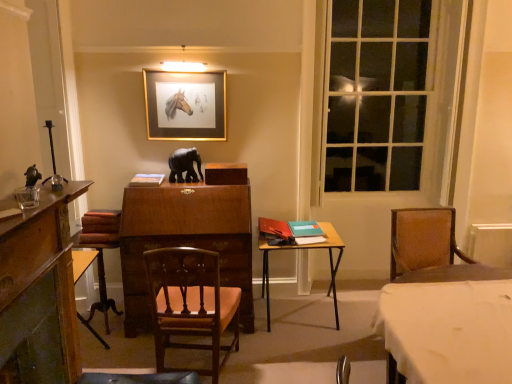
What do you see at coordinates (448, 325) in the screenshot? This screenshot has width=512, height=384. I see `white cloth-covered table at lower right, which is counted as the second table, starting from the back` at bounding box center [448, 325].

This screenshot has height=384, width=512. What do you see at coordinates (301, 250) in the screenshot?
I see `wooden table at center, the second table when ordered from right to left` at bounding box center [301, 250].

What is the approximate width of wooden table at center, which appears as the first table when viewed from the back?

The width of wooden table at center, which appears as the first table when viewed from the back, is 24.28 inches.

Describe the element at coordinates (385, 95) in the screenshot. The height and width of the screenshot is (384, 512). I see `clear glass window at right` at that location.

The image size is (512, 384). Identify the location of clear glass window at right. (385, 95).

In order to face gold-framed picture at upper center, should I rotate leftwards or rightwards?

A 9.398 degree turn to the left will do.

Identify the location of wooden chair at center. The height and width of the screenshot is (384, 512). (190, 303).

Is wooden table at center, which is counted as the second table, starting from the front, bigger or smaller than white cloth-covered table at lower right, arranged as the 1th table when viewed from the right?

In the image, wooden table at center, which is counted as the second table, starting from the front, appears to be smaller than white cloth-covered table at lower right, arranged as the 1th table when viewed from the right.

Is wooden table at center, the first table positioned from the left, spatially inside white cloth-covered table at lower right, arranged as the 1th table when viewed from the right, or outside of it?

wooden table at center, the first table positioned from the left, is outside white cloth-covered table at lower right, arranged as the 1th table when viewed from the right.

From the image's perspective, is wooden table at center, which appears as the first table when viewed from the back, under white cloth-covered table at lower right, which is counted as the second table, starting from the back?

No.

From the picture: In terms of height, does white cloth-covered table at lower right, the 2th table viewed from the left, look taller or shorter compared to matte black elephant at center?

Clearly, white cloth-covered table at lower right, the 2th table viewed from the left, is taller compared to matte black elephant at center.

Does white cloth-covered table at lower right, arranged as the 1th table when viewed from the right, have a larger size compared to matte black elephant at center?

Yes, white cloth-covered table at lower right, arranged as the 1th table when viewed from the right, is bigger than matte black elephant at center.

Would you consider white cloth-covered table at lower right, the first table from the front, to be distant from matte black elephant at center?

white cloth-covered table at lower right, the first table from the front, is positioned a significant distance from matte black elephant at center.

Which is correct: white cloth-covered table at lower right, the 2th table viewed from the left, is inside matte black elephant at center, or outside of it?

white cloth-covered table at lower right, the 2th table viewed from the left, is outside matte black elephant at center.

From the image's perspective, between clear glass window at right and wooden table at center, which appears as the first table when viewed from the back, which one is located above?

From the image's view, clear glass window at right is above.

Can you confirm if clear glass window at right is positioned to the right of wooden table at center, the first table positioned from the left?

Yes.

Can you confirm if clear glass window at right is bigger than wooden table at center, which is counted as the second table, starting from the front?

Actually, clear glass window at right might be smaller than wooden table at center, which is counted as the second table, starting from the front.

How different are the orientations of clear glass window at right and wooden table at center, which appears as the first table when viewed from the back, in degrees?

The angle between the facing direction of clear glass window at right and the facing direction of wooden table at center, which appears as the first table when viewed from the back, is 0.992 degrees.

The image size is (512, 384). I want to click on elephant in front of the gold-framed picture at upper center, so click(184, 165).

Is point (145, 105) farther from viewer compared to point (176, 172)?

Yes, it is.

Considering the positions of objects gold-framed picture at upper center and matte black elephant at center in the image provided, who is behind, gold-framed picture at upper center or matte black elephant at center?

gold-framed picture at upper center is further away from the camera.

Considering the positions of objects gold-framed picture at upper center and matte black elephant at center in the image provided, who is more to the left, gold-framed picture at upper center or matte black elephant at center?

matte black elephant at center is more to the left.

Looking at this image, from a real-world perspective, is white cloth-covered table at lower right, the first table from the front, positioned over clear glass window at right based on gravity?

No, from a real-world perspective, white cloth-covered table at lower right, the first table from the front, is not over clear glass window at right

From the image's perspective, is white cloth-covered table at lower right, arranged as the 1th table when viewed from the right, above clear glass window at right?

No, from the image's perspective, white cloth-covered table at lower right, arranged as the 1th table when viewed from the right, is not over clear glass window at right.

Is white cloth-covered table at lower right, the 2th table viewed from the left, with clear glass window at right?

No, white cloth-covered table at lower right, the 2th table viewed from the left, is not next to clear glass window at right.

Does point (438, 270) come farther from viewer compared to point (423, 36)?

No, (438, 270) is closer to viewer.

In terms of height, does gold-framed picture at upper center look taller or shorter compared to clear glass window at right?

Clearly, gold-framed picture at upper center is shorter compared to clear glass window at right.

Is gold-framed picture at upper center looking in the opposite direction of clear glass window at right?

No, clear glass window at right is not at the back of gold-framed picture at upper center.

Considering the sizes of objects gold-framed picture at upper center and clear glass window at right in the image provided, who is wider, gold-framed picture at upper center or clear glass window at right?

gold-framed picture at upper center.

Which is in front, gold-framed picture at upper center or clear glass window at right?

Positioned in front is clear glass window at right.

How many degrees apart are the facing directions of matte black elephant at center and wooden chair at center?

The angular difference between matte black elephant at center and wooden chair at center is 171 degrees.

From the image's perspective, is matte black elephant at center beneath wooden chair at center?

Incorrect, from the image's perspective, matte black elephant at center is higher than wooden chair at center.

Considering the sizes of objects matte black elephant at center and wooden chair at center in the image provided, who is wider, matte black elephant at center or wooden chair at center?

With larger width is wooden chair at center.

Considering the sizes of objects matte black elephant at center and wooden chair at center in the image provided, who is shorter, matte black elephant at center or wooden chair at center?

With less height is matte black elephant at center.

Where is `table to the right of wooden table at center, the first table positioned from the left`? table to the right of wooden table at center, the first table positioned from the left is located at coordinates (448, 325).

Locate an element on the screen. The image size is (512, 384). elephant on the left of the white cloth-covered table at lower right, which is counted as the second table, starting from the back is located at coordinates (184, 165).

Based on the photo, from the image, which object appears to be farther from gold-framed picture at upper center, brown wood swivel chair at lower left or wooden chair at center?

wooden chair at center is further to gold-framed picture at upper center.

Considering their positions, is gold-framed picture at upper center positioned further to wooden table at center, which is counted as the second table, starting from the front, than matte black elephant at center?

gold-framed picture at upper center.

Considering their positions, is clear glass window at right positioned closer to matte black elephant at center than wooden chair at center?

Based on the image, wooden chair at center appears to be nearer to matte black elephant at center.

Estimate the real-world distances between objects in this image. Which object is closer to matte black elephant at center, gold-framed picture at upper center or wooden chair at center?

gold-framed picture at upper center lies closer to matte black elephant at center than the other object.

Which object lies nearer to the anchor point wooden chair at center, brown wood swivel chair at lower left or gold-framed picture at upper center?

Based on the image, brown wood swivel chair at lower left appears to be nearer to wooden chair at center.

From the image, which object appears to be farther from wooden table at center, which appears as the first table when viewed from the back, matte black elephant at center or white cloth-covered table at lower right, the 2th table viewed from the left?

Based on the image, white cloth-covered table at lower right, the 2th table viewed from the left, appears to be further to wooden table at center, which appears as the first table when viewed from the back.

When comparing their distances from wooden chair at center, does clear glass window at right or wooden table at center, the second table when ordered from right to left, seem further?

The object further to wooden chair at center is clear glass window at right.

Which object lies nearer to the anchor point wooden chair at center, wooden table at center, the second table when ordered from right to left, or brown wood swivel chair at lower left?

Among the two, brown wood swivel chair at lower left is located nearer to wooden chair at center.

Identify the location of table between gold-framed picture at upper center and clear glass window at right. (301, 250).

Image resolution: width=512 pixels, height=384 pixels. I want to click on chair located between gold-framed picture at upper center and clear glass window at right in the left-right direction, so click(190, 303).

Identify the location of chair located between brown wood swivel chair at lower left and clear glass window at right in the left-right direction. The image size is (512, 384). (190, 303).

The image size is (512, 384). What are the coordinates of `chair between matte black elephant at center and white cloth-covered table at lower right, the 2th table viewed from the left, in the horizontal direction` in the screenshot? It's located at (190, 303).